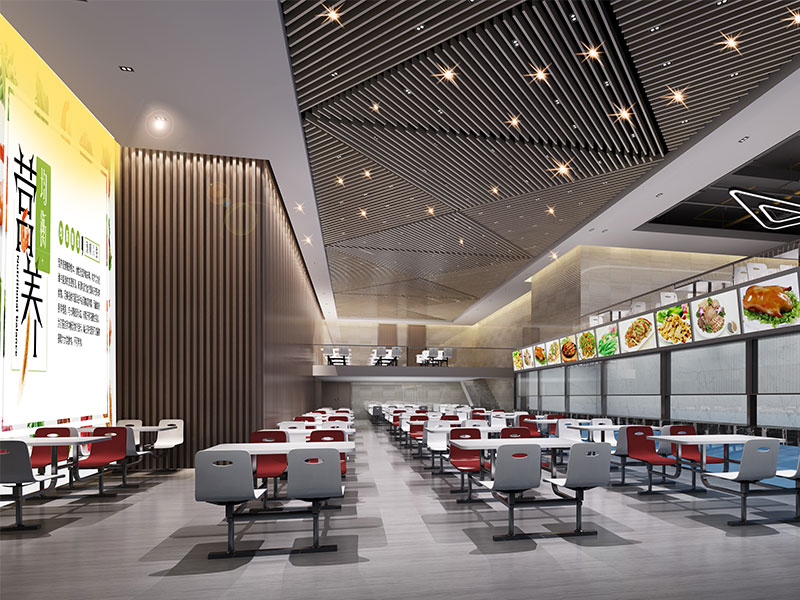
I want to click on ceiling, so click(x=445, y=227), click(x=240, y=95).